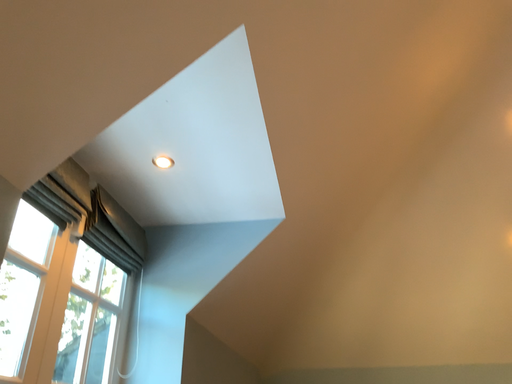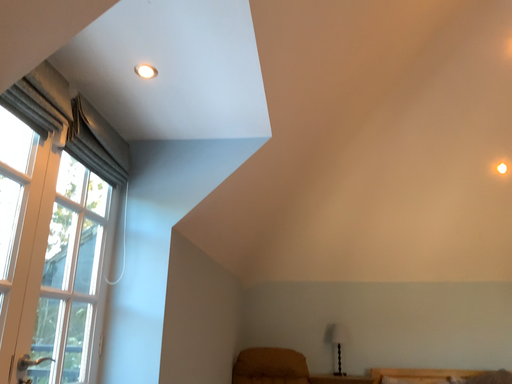
Question: How did the camera likely rotate when shooting the video?

Choices:
 (A) rotated upward
 (B) rotated downward

Answer: (B)